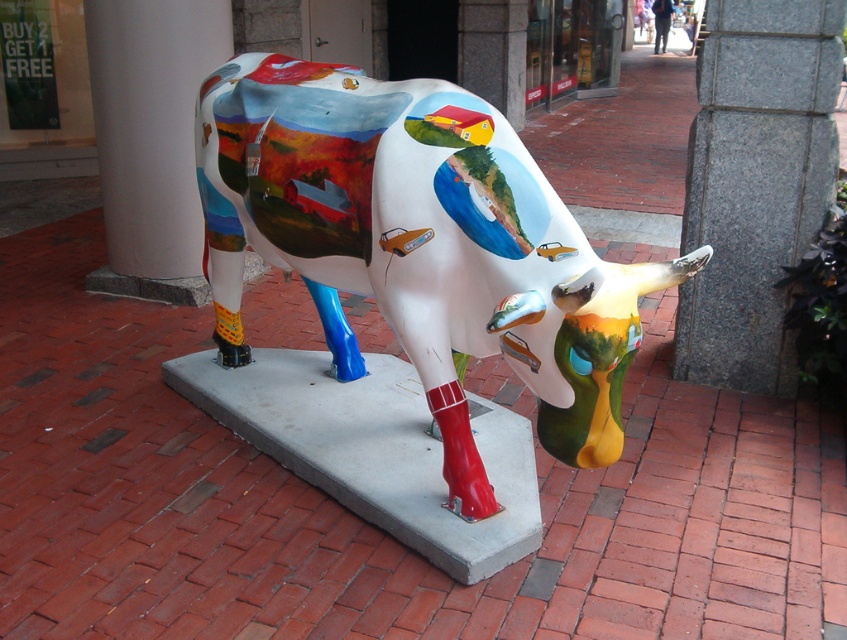
Question: Observing the image, what is the correct spatial positioning of painted ceramic cow at center in reference to granite pillar at center?

Choices:
 (A) right
 (B) left

Answer: (B)

Question: Can you confirm if painted ceramic cow at center is wider than granite pillar at center?

Choices:
 (A) yes
 (B) no

Answer: (A)

Question: Is painted ceramic cow at center positioned before granite pillar at center?

Choices:
 (A) no
 (B) yes

Answer: (B)

Question: Which point is farther to the camera?

Choices:
 (A) granite pillar at center
 (B) painted ceramic cow at center

Answer: (A)

Question: Which object is closer to the camera taking this photo?

Choices:
 (A) white smooth pillar at upper left
 (B) painted ceramic cow at center
 (C) granite pillar at center

Answer: (B)

Question: Which point is farther to the camera?

Choices:
 (A) painted ceramic cow at center
 (B) white smooth pillar at upper left

Answer: (B)